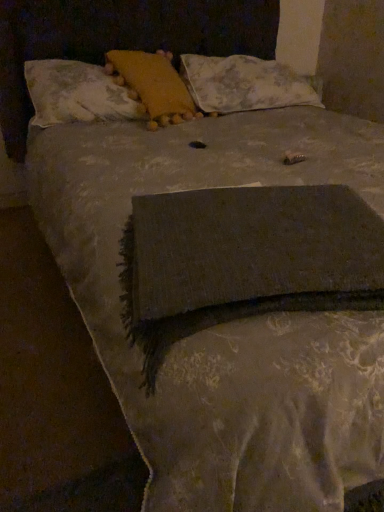
In order to click on floral fabric pillow at upper center, placed as the 1th pillow when sorted from right to left in this screenshot , I will do `click(244, 84)`.

The height and width of the screenshot is (512, 384). What do you see at coordinates (244, 84) in the screenshot?
I see `floral fabric pillow at upper center, placed as the 1th pillow when sorted from right to left` at bounding box center [244, 84].

Find the location of a particular element. floral fabric pillow at upper center, which appears as the 3th pillow when viewed from the left is located at coordinates (244, 84).

Does floral fabric pillow at upper center, which appears as the 3th pillow when viewed from the left, have a lesser width compared to yellow fabric pillow at upper center, the second pillow viewed from the left?

In fact, floral fabric pillow at upper center, which appears as the 3th pillow when viewed from the left, might be wider than yellow fabric pillow at upper center, the second pillow viewed from the left.

Is point (187, 85) farther from viewer compared to point (158, 121)?

Yes, it is behind point (158, 121).

Considering the sizes of objects floral fabric pillow at upper center, which appears as the 3th pillow when viewed from the left, and yellow fabric pillow at upper center, the second pillow viewed from the left, in the image provided, who is smaller, floral fabric pillow at upper center, which appears as the 3th pillow when viewed from the left, or yellow fabric pillow at upper center, the second pillow viewed from the left,?

yellow fabric pillow at upper center, the second pillow viewed from the left, is smaller.

Could you tell me if floral fabric pillow at upper center, which appears as the 3th pillow when viewed from the left, is facing yellow fabric pillow at upper center, the second pillow viewed from the left?

No, floral fabric pillow at upper center, which appears as the 3th pillow when viewed from the left, does not turn towards yellow fabric pillow at upper center, the second pillow viewed from the left.

From a real-world perspective, between yellow fabric pillow at upper center, the second pillow viewed from the left, and fluffy white pillow at upper center, acting as the 3th pillow starting from the right, who is vertically higher?

yellow fabric pillow at upper center, the second pillow viewed from the left, from a real-world perspective.

Between yellow fabric pillow at upper center, the second pillow viewed from the left, and fluffy white pillow at upper center, acting as the 3th pillow starting from the right, which one has more height?

With more height is yellow fabric pillow at upper center, the second pillow viewed from the left.

Which is in front, point (139, 94) or point (103, 87)?

Point (103, 87)

Consider the image. Are yellow fabric pillow at upper center, the second pillow in the right-to-left sequence, and fluffy white pillow at upper center, acting as the first pillow starting from the left, far apart?

yellow fabric pillow at upper center, the second pillow in the right-to-left sequence, is near fluffy white pillow at upper center, acting as the first pillow starting from the left, not far away.

Is fluffy white pillow at upper center, acting as the 3th pillow starting from the right, not within floral fabric pillow at upper center, placed as the 1th pillow when sorted from right to left?

Absolutely, fluffy white pillow at upper center, acting as the 3th pillow starting from the right, is external to floral fabric pillow at upper center, placed as the 1th pillow when sorted from right to left.

Is fluffy white pillow at upper center, acting as the first pillow starting from the left, taller than floral fabric pillow at upper center, placed as the 1th pillow when sorted from right to left?

In fact, fluffy white pillow at upper center, acting as the first pillow starting from the left, may be shorter than floral fabric pillow at upper center, placed as the 1th pillow when sorted from right to left.

Are fluffy white pillow at upper center, acting as the first pillow starting from the left, and floral fabric pillow at upper center, which appears as the 3th pillow when viewed from the left, located far from each other?

No, fluffy white pillow at upper center, acting as the first pillow starting from the left, is not far from floral fabric pillow at upper center, which appears as the 3th pillow when viewed from the left.

Considering the sizes of objects fluffy white pillow at upper center, acting as the 3th pillow starting from the right, and floral fabric pillow at upper center, placed as the 1th pillow when sorted from right to left, in the image provided, who is bigger, fluffy white pillow at upper center, acting as the 3th pillow starting from the right, or floral fabric pillow at upper center, placed as the 1th pillow when sorted from right to left,?

With larger size is floral fabric pillow at upper center, placed as the 1th pillow when sorted from right to left.

Can you confirm if floral fabric pillow at upper center, which appears as the 3th pillow when viewed from the left, is taller than fluffy white pillow at upper center, acting as the first pillow starting from the left?

Yes, floral fabric pillow at upper center, which appears as the 3th pillow when viewed from the left, is taller than fluffy white pillow at upper center, acting as the first pillow starting from the left.

Can you confirm if floral fabric pillow at upper center, placed as the 1th pillow when sorted from right to left, is thinner than fluffy white pillow at upper center, acting as the first pillow starting from the left?

No, floral fabric pillow at upper center, placed as the 1th pillow when sorted from right to left, is not thinner than fluffy white pillow at upper center, acting as the first pillow starting from the left.

How different are the orientations of floral fabric pillow at upper center, placed as the 1th pillow when sorted from right to left, and fluffy white pillow at upper center, acting as the first pillow starting from the left, in degrees?

floral fabric pillow at upper center, placed as the 1th pillow when sorted from right to left, and fluffy white pillow at upper center, acting as the first pillow starting from the left, are facing 0.601 degrees away from each other.

Does floral fabric pillow at upper center, placed as the 1th pillow when sorted from right to left, contain fluffy white pillow at upper center, acting as the 3th pillow starting from the right?

No, fluffy white pillow at upper center, acting as the 3th pillow starting from the right, is located outside of floral fabric pillow at upper center, placed as the 1th pillow when sorted from right to left.

Is point (58, 102) positioned after point (148, 123)?

No.

Is fluffy white pillow at upper center, acting as the first pillow starting from the left, in front of or behind yellow fabric pillow at upper center, the second pillow viewed from the left, in the image?

fluffy white pillow at upper center, acting as the first pillow starting from the left, is in front of yellow fabric pillow at upper center, the second pillow viewed from the left.

Who is smaller, fluffy white pillow at upper center, acting as the 3th pillow starting from the right, or yellow fabric pillow at upper center, the second pillow in the right-to-left sequence?

yellow fabric pillow at upper center, the second pillow in the right-to-left sequence.

In the scene shown: Is the surface of fluffy white pillow at upper center, acting as the 3th pillow starting from the right, in direct contact with yellow fabric pillow at upper center, the second pillow in the right-to-left sequence?

No, fluffy white pillow at upper center, acting as the 3th pillow starting from the right, is not beside yellow fabric pillow at upper center, the second pillow in the right-to-left sequence.

How different are the orientations of yellow fabric pillow at upper center, the second pillow viewed from the left, and floral fabric pillow at upper center, which appears as the 3th pillow when viewed from the left, in degrees?

18.1 degrees separate the facing orientations of yellow fabric pillow at upper center, the second pillow viewed from the left, and floral fabric pillow at upper center, which appears as the 3th pillow when viewed from the left.

From a real-world perspective, is yellow fabric pillow at upper center, the second pillow viewed from the left, on floral fabric pillow at upper center, which appears as the 3th pillow when viewed from the left?

Yes, from a real-world perspective, yellow fabric pillow at upper center, the second pillow viewed from the left, is on top of floral fabric pillow at upper center, which appears as the 3th pillow when viewed from the left.

Looking at the image, does yellow fabric pillow at upper center, the second pillow in the right-to-left sequence, seem bigger or smaller compared to floral fabric pillow at upper center, which appears as the 3th pillow when viewed from the left?

Considering their sizes, yellow fabric pillow at upper center, the second pillow in the right-to-left sequence, takes up less space than floral fabric pillow at upper center, which appears as the 3th pillow when viewed from the left.

Is yellow fabric pillow at upper center, the second pillow in the right-to-left sequence, wider than floral fabric pillow at upper center, placed as the 1th pillow when sorted from right to left?

No, yellow fabric pillow at upper center, the second pillow in the right-to-left sequence, is not wider than floral fabric pillow at upper center, placed as the 1th pillow when sorted from right to left.

The width and height of the screenshot is (384, 512). Identify the location of pillow that appears above the yellow fabric pillow at upper center, the second pillow in the right-to-left sequence (from the image's perspective). (244, 84).

At what (x,y) coordinates should I click in order to perform the action: click on pillow above the fluffy white pillow at upper center, acting as the first pillow starting from the left (from a real-world perspective). Please return your answer as a coordinate pair (x, y). Looking at the image, I should click on (153, 85).

Looking at the image, which one is located closer to fluffy white pillow at upper center, acting as the first pillow starting from the left, yellow fabric pillow at upper center, the second pillow viewed from the left, or floral fabric pillow at upper center, which appears as the 3th pillow when viewed from the left?

yellow fabric pillow at upper center, the second pillow viewed from the left.

From the image, which object appears to be nearer to floral fabric pillow at upper center, placed as the 1th pillow when sorted from right to left, fluffy white pillow at upper center, acting as the 3th pillow starting from the right, or yellow fabric pillow at upper center, the second pillow viewed from the left?

yellow fabric pillow at upper center, the second pillow viewed from the left, lies closer to floral fabric pillow at upper center, placed as the 1th pillow when sorted from right to left, than the other object.

From the image, which object appears to be farther from floral fabric pillow at upper center, which appears as the 3th pillow when viewed from the left, yellow fabric pillow at upper center, the second pillow viewed from the left, or fluffy white pillow at upper center, acting as the first pillow starting from the left?

fluffy white pillow at upper center, acting as the first pillow starting from the left, is further to floral fabric pillow at upper center, which appears as the 3th pillow when viewed from the left.

Based on their spatial positions, is fluffy white pillow at upper center, acting as the first pillow starting from the left, or floral fabric pillow at upper center, which appears as the 3th pillow when viewed from the left, further from yellow fabric pillow at upper center, the second pillow viewed from the left?

The object further to yellow fabric pillow at upper center, the second pillow viewed from the left, is floral fabric pillow at upper center, which appears as the 3th pillow when viewed from the left.

Estimate the real-world distances between objects in this image. Which object is closer to yellow fabric pillow at upper center, the second pillow viewed from the left, floral fabric pillow at upper center, which appears as the 3th pillow when viewed from the left, or fluffy white pillow at upper center, acting as the 3th pillow starting from the right?

The object closer to yellow fabric pillow at upper center, the second pillow viewed from the left, is fluffy white pillow at upper center, acting as the 3th pillow starting from the right.

When comparing their distances from fluffy white pillow at upper center, acting as the 3th pillow starting from the right, does floral fabric pillow at upper center, which appears as the 3th pillow when viewed from the left, or yellow fabric pillow at upper center, the second pillow viewed from the left, seem closer?

yellow fabric pillow at upper center, the second pillow viewed from the left, lies closer to fluffy white pillow at upper center, acting as the 3th pillow starting from the right, than the other object.

What are the coordinates of `pillow situated between fluffy white pillow at upper center, acting as the 3th pillow starting from the right, and floral fabric pillow at upper center, which appears as the 3th pillow when viewed from the left, from left to right` in the screenshot? It's located at (153, 85).